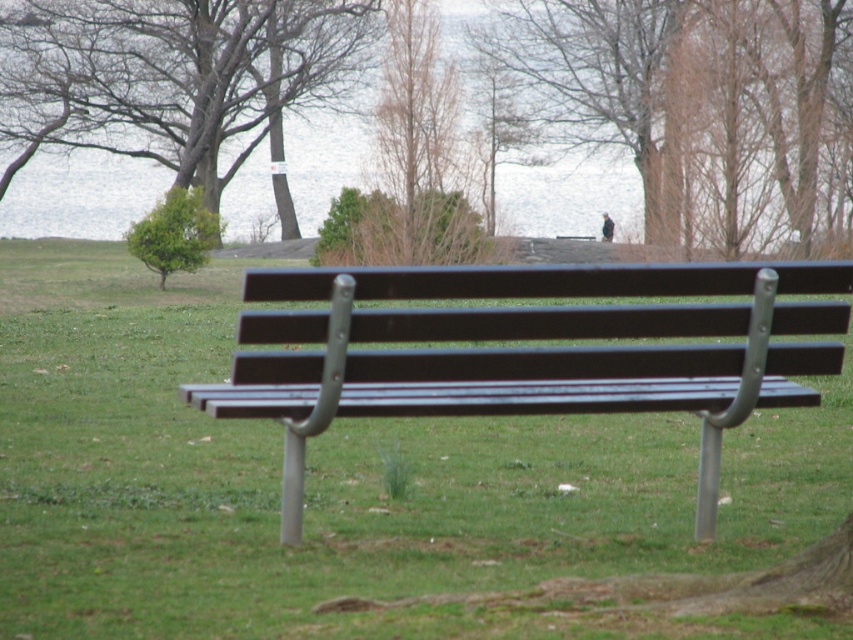
Question: Which of these objects is positioned closest to the smooth bark tree at upper left?

Choices:
 (A) brown/dried wood tree at upper center
 (B) brown wood tree at upper center
 (C) green leafy tree at upper left

Answer: (A)

Question: Is brown/dried wood tree at upper center thinner than green leafy tree at upper left?

Choices:
 (A) yes
 (B) no

Answer: (B)

Question: Considering the relative positions of matte black bench at center and brown/dried wood tree at upper center in the image provided, where is matte black bench at center located with respect to brown/dried wood tree at upper center?

Choices:
 (A) above
 (B) below

Answer: (B)

Question: Estimate the real-world distances between objects in this image. Which object is closer to the green leafy tree at upper left?

Choices:
 (A) matte black bench at center
 (B) brown/dried wood tree at upper center

Answer: (B)

Question: Can you confirm if brown wood tree at upper center is smaller than brown/dried wood tree at upper center?

Choices:
 (A) no
 (B) yes

Answer: (A)

Question: Considering the real-world distances, which object is farthest from the brown wood tree at upper center?

Choices:
 (A) smooth bark tree at upper left
 (B) matte black bench at center
 (C) brown/dried wood tree at upper center

Answer: (B)